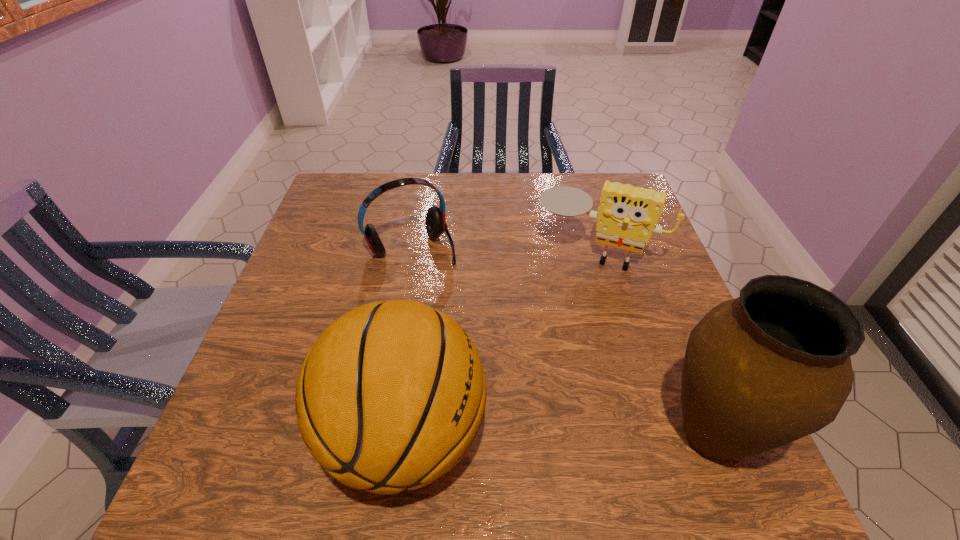
Identify the location of basketball. Image resolution: width=960 pixels, height=540 pixels. (391, 396).

You are a GUI agent. You are given a task and a screenshot of the screen. Output one action in this format:
    pyautogui.click(x=<x>, y=<y>)
    Task: Click on the urn
    
    Given the screenshot: What is the action you would take?
    pyautogui.click(x=772, y=366)

Find the location of a particular element. The image size is (960, 540). sponge is located at coordinates pos(627,216).

At what (x,y) coordinates should I click in order to perform the action: click on headset. Please return your answer as a coordinate pair (x, y). Looking at the image, I should click on (436, 225).

Identify the location of vacant space located on the surface of the basketball near the brand logo. The width and height of the screenshot is (960, 540). (247, 436).

Where is `vacant region located on the surface of the basketball near the brand logo`? This screenshot has width=960, height=540. vacant region located on the surface of the basketball near the brand logo is located at coordinates (280, 436).

What are the coordinates of `vacant space located 0.070m on the surface of the basketball near the brand logo` in the screenshot? It's located at [286, 436].

I want to click on free location located 0.320m on the back of the urn, so pos(647,273).

Locate an element on the screen. vacant area situated 0.090m on the front-facing side of the sponge is located at coordinates (568, 296).

Locate an element on the screen. Image resolution: width=960 pixels, height=540 pixels. free location located 0.380m on the front-facing side of the sponge is located at coordinates (530, 397).